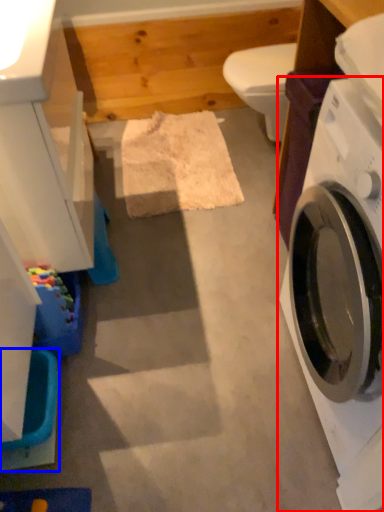
Question: Among these objects, which one is nearest to the camera, washing machine (highlighted by a red box) or washer (highlighted by a blue box)?

Choices:
 (A) washing machine
 (B) washer

Answer: (A)